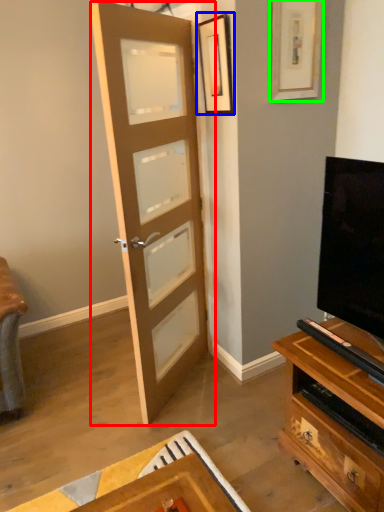
Question: Which is nearer to the door (highlighted by a red box)? picture frame (highlighted by a blue box) or picture frame (highlighted by a green box).

Choices:
 (A) picture frame
 (B) picture frame

Answer: (A)